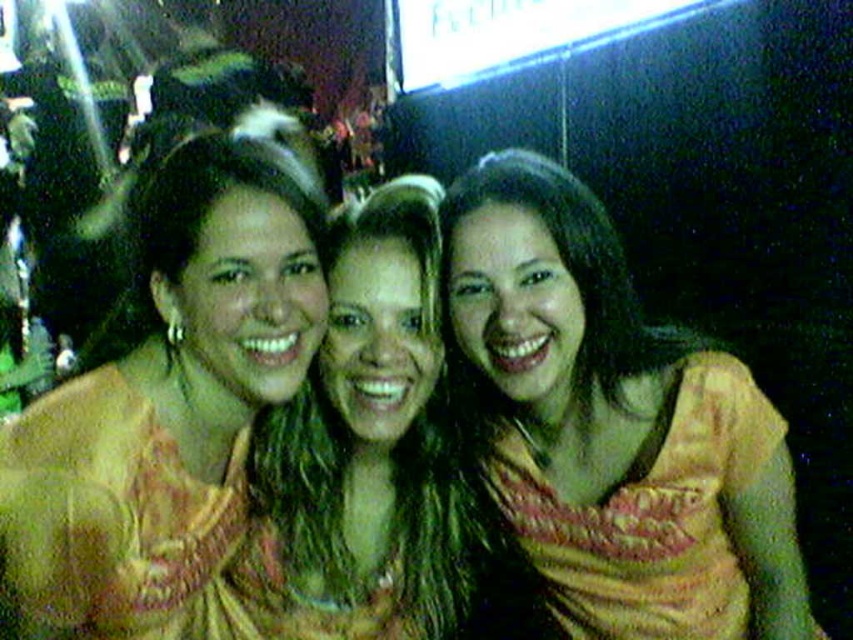
Question: Which point is farther to the camera?

Choices:
 (A) (556, 557)
 (B) (311, 227)

Answer: (A)

Question: Can you confirm if yellow-orange fabric at center is positioned above matte yellow blouse at center?

Choices:
 (A) yes
 (B) no

Answer: (B)

Question: From the image, what is the correct spatial relationship of yellow-orange fabric at center in relation to matte yellow blouse at center?

Choices:
 (A) below
 (B) above

Answer: (A)

Question: Can you confirm if yellow-orange fabric at center is positioned to the left of matte yellow blouse at center?

Choices:
 (A) no
 (B) yes

Answer: (A)

Question: Which point is closer to the camera?

Choices:
 (A) (177, 452)
 (B) (637, 374)

Answer: (A)

Question: Among these objects, which one is nearest to the camera?

Choices:
 (A) yellow-orange fabric at center
 (B) matte yellow blouse at center

Answer: (B)